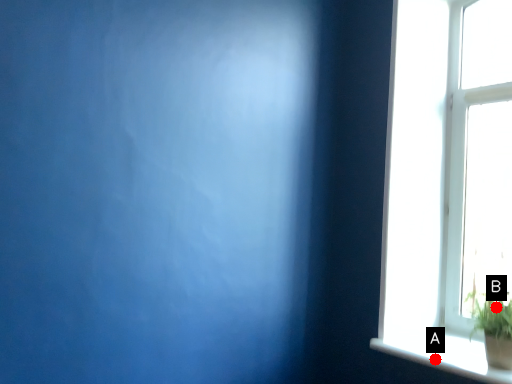
Question: Two points are circled on the image, labeled by A and B beside each circle. Which point is closer to the camera?

Choices:
 (A) A is closer
 (B) B is closer

Answer: (B)